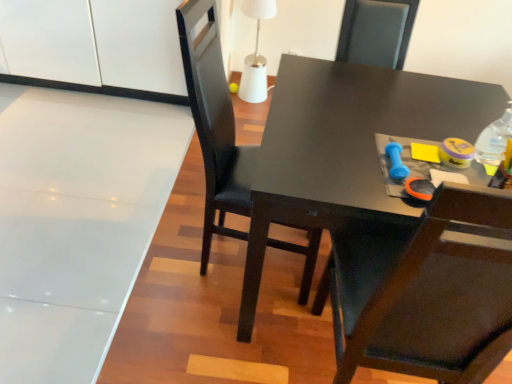
Question: From a real-world perspective, is blue rubber dumbbell at upper right located higher than matte black table at center?

Choices:
 (A) yes
 (B) no

Answer: (A)

Question: Could you tell me if blue rubber dumbbell at upper right is turned towards matte black table at center?

Choices:
 (A) yes
 (B) no

Answer: (B)

Question: Is matte black table at center located within blue rubber dumbbell at upper right?

Choices:
 (A) yes
 (B) no

Answer: (B)

Question: Is blue rubber dumbbell at upper right shorter than matte black table at center?

Choices:
 (A) no
 (B) yes

Answer: (B)

Question: Is blue rubber dumbbell at upper right at the right side of matte black table at center?

Choices:
 (A) no
 (B) yes

Answer: (A)

Question: From a real-world perspective, is transparent plastic bottle at upper right physically located above or below matte black chair at center?

Choices:
 (A) above
 (B) below

Answer: (A)

Question: From the image's perspective, is transparent plastic bottle at upper right located above or below matte black chair at center?

Choices:
 (A) above
 (B) below

Answer: (A)

Question: Considering their positions, is transparent plastic bottle at upper right located in front of or behind matte black chair at center?

Choices:
 (A) front
 (B) behind

Answer: (B)

Question: Based on their sizes in the image, would you say transparent plastic bottle at upper right is bigger or smaller than matte black chair at center?

Choices:
 (A) small
 (B) big

Answer: (A)

Question: From the image's perspective, is white glossy cabinet at upper left positioned above or below blue rubber dumbbell at upper right?

Choices:
 (A) above
 (B) below

Answer: (A)

Question: Is white glossy cabinet at upper left in front of or behind blue rubber dumbbell at upper right in the image?

Choices:
 (A) front
 (B) behind

Answer: (B)

Question: Looking at their shapes, would you say white glossy cabinet at upper left is wider or thinner than blue rubber dumbbell at upper right?

Choices:
 (A) thin
 (B) wide

Answer: (B)

Question: Is white glossy cabinet at upper left to the left or to the right of blue rubber dumbbell at upper right in the image?

Choices:
 (A) right
 (B) left

Answer: (B)

Question: From the image's perspective, is matte black table at center positioned above or below matte black chair at center?

Choices:
 (A) above
 (B) below

Answer: (B)

Question: From a real-world perspective, relative to matte black chair at center, is matte black table at center vertically above or below?

Choices:
 (A) below
 (B) above

Answer: (A)